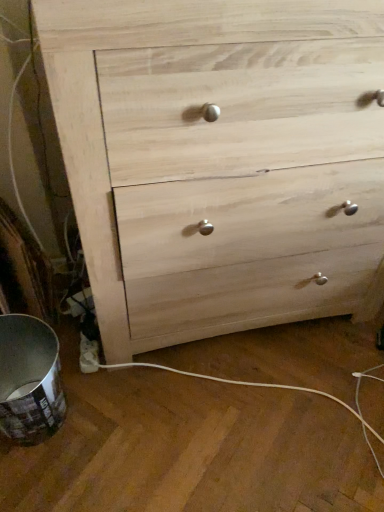
Question: Should I look upward or downward to see natural wood chest of drawers at center?

Choices:
 (A) down
 (B) up

Answer: (B)